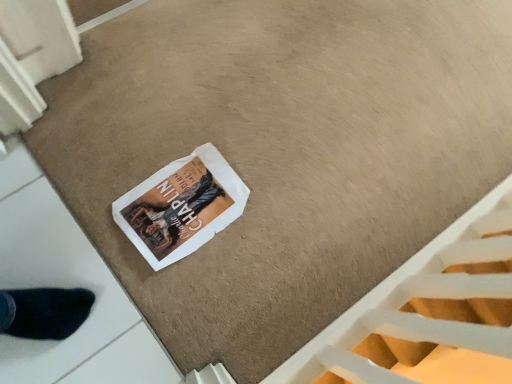
The width and height of the screenshot is (512, 384). Find the location of `free space behind white paper magazine at center`. free space behind white paper magazine at center is located at coordinates (248, 142).